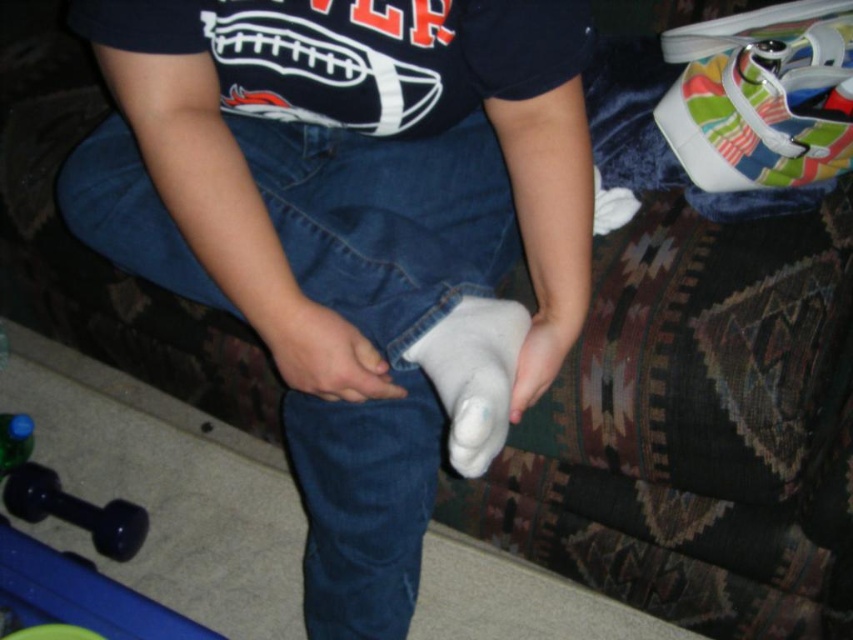
Does white matte cast at lower center appear under white soft sock at center?

No.

From the picture: Which is more to the left, white matte cast at lower center or white soft sock at center?

From the viewer's perspective, white matte cast at lower center appears more on the left side.

At what (x,y) coordinates should I click in order to perform the action: click on white matte cast at lower center. Please return your answer as a coordinate pair (x, y). Looking at the image, I should click on (343, 212).

Based on the photo, which is more to the right, white soft sock at center or rubberized black dumbbell at lower left?

Positioned to the right is white soft sock at center.

Is point (451, 356) positioned after point (119, 536)?

No, (451, 356) is closer to viewer.

I want to click on white soft sock at center, so click(473, 376).

Based on the photo, is white matte bandage at center to the right of rubberized black dumbbell at lower left from the viewer's perspective?

→ Indeed, white matte bandage at center is positioned on the right side of rubberized black dumbbell at lower left.

Which of these two, white matte bandage at center or rubberized black dumbbell at lower left, stands taller?

rubberized black dumbbell at lower left

Does point (310, 358) lie in front of point (24, 508)?

Yes, point (310, 358) is closer to viewer.

Where is `white matte bandage at center`? white matte bandage at center is located at coordinates (318, 348).